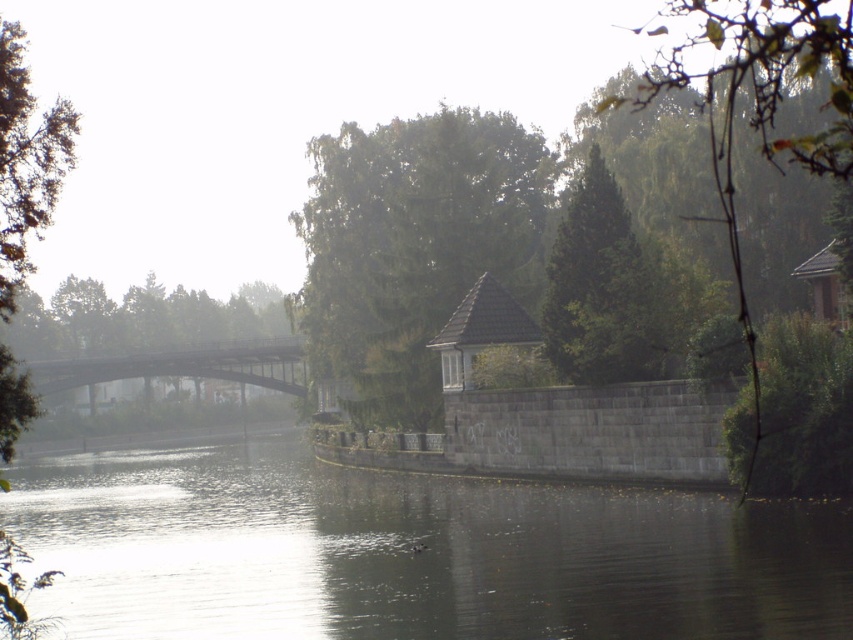
Question: Which point is closer to the camera?

Choices:
 (A) (54, 316)
 (B) (16, 116)
 (C) (444, 589)

Answer: (B)

Question: Which object appears farthest from the camera in this image?

Choices:
 (A) green matte tree at left
 (B) dark reflective water at center
 (C) green leafy tree at center
 (D) green leafy tree at left

Answer: (A)

Question: Which is nearer to the green textured tree at center?

Choices:
 (A) green leafy tree at center
 (B) green matte tree at left

Answer: (A)

Question: Can you confirm if green leafy tree at center is positioned above green textured tree at center?

Choices:
 (A) yes
 (B) no

Answer: (B)

Question: In this image, where is green leafy tree at center located relative to green leafy tree at left?

Choices:
 (A) above
 (B) below

Answer: (A)

Question: In this image, where is green leafy tree at center located relative to green matte tree at left?

Choices:
 (A) left
 (B) right

Answer: (B)